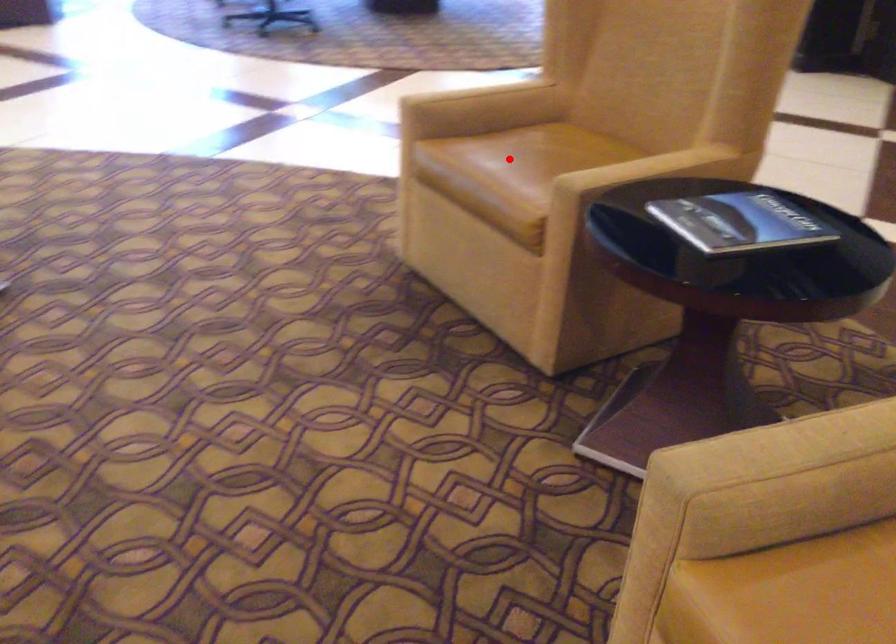
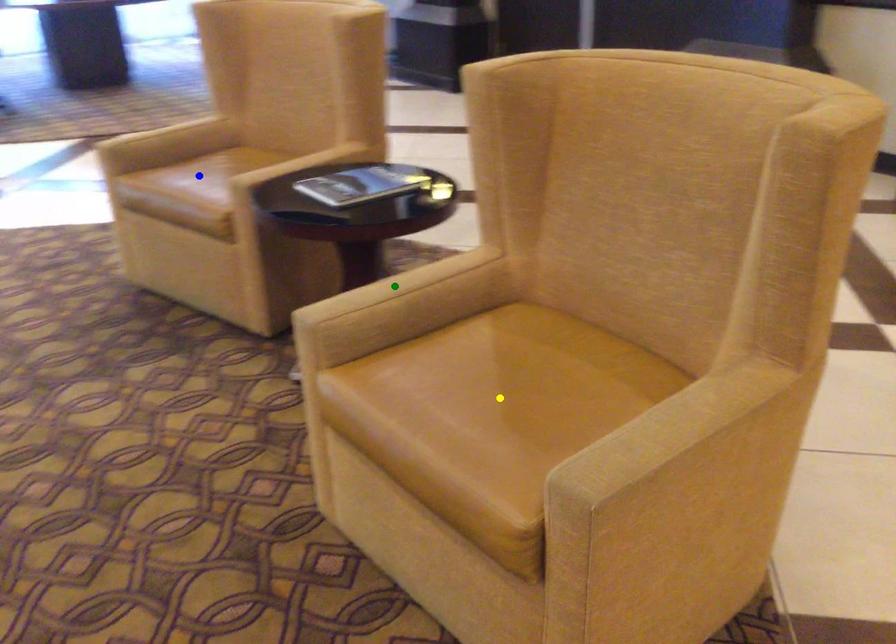
Question: I am providing you with two images of the same scene from different viewpoints. A red point is marked on the first image. You are given multiple points on the second image. Can you choose the point in image 2 that corresponds to the point in image 1?

Choices:
 (A) blue point
 (B) green point
 (C) yellow point

Answer: (A)